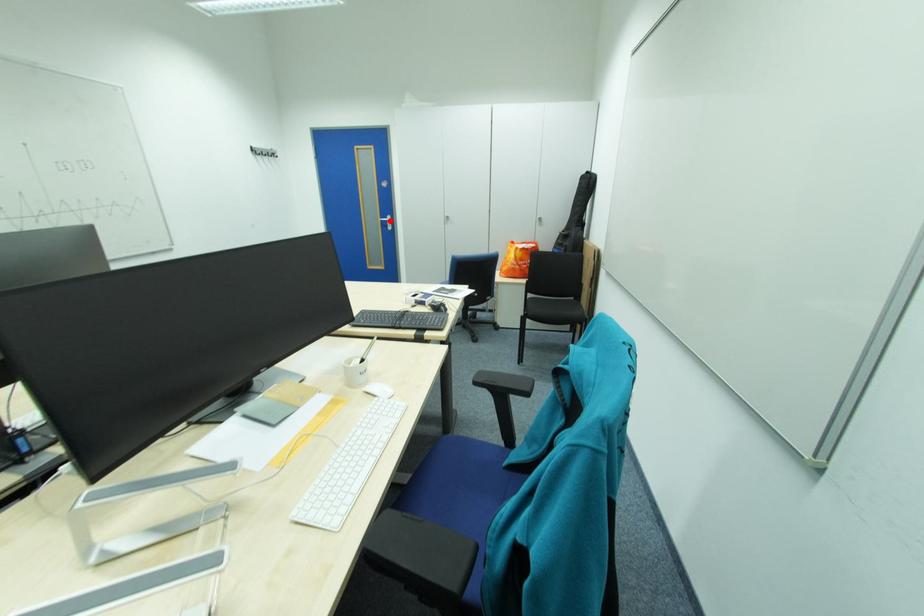
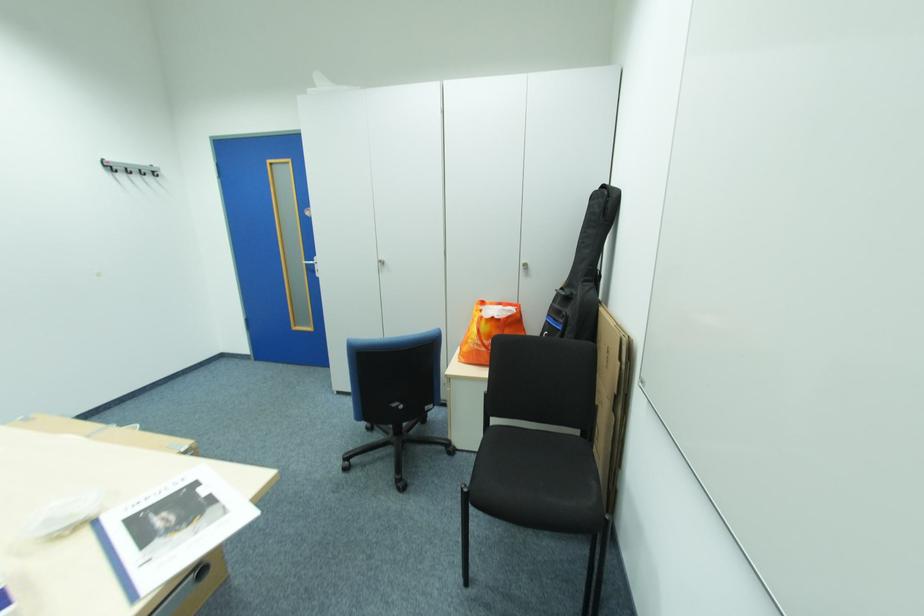
Where in the second image is the point corresponding to the highlighted location from the first image?

(314, 265)